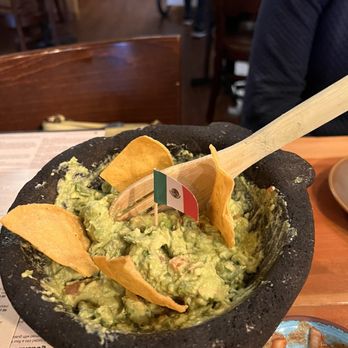
The height and width of the screenshot is (348, 348). Find the location of `bowl`. bowl is located at coordinates (280, 303).